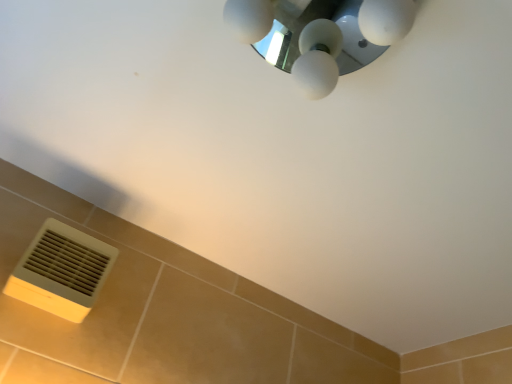
Question: Is white glossy light fixture at upper center oriented towards beige plastic air conditioning at lower left?

Choices:
 (A) yes
 (B) no

Answer: (B)

Question: Can you confirm if white glossy light fixture at upper center is shorter than beige plastic air conditioning at lower left?

Choices:
 (A) yes
 (B) no

Answer: (A)

Question: From the image's perspective, is white glossy light fixture at upper center on beige plastic air conditioning at lower left?

Choices:
 (A) no
 (B) yes

Answer: (B)

Question: From a real-world perspective, is white glossy light fixture at upper center located higher than beige plastic air conditioning at lower left?

Choices:
 (A) yes
 (B) no

Answer: (A)

Question: From the image's perspective, does white glossy light fixture at upper center appear lower than beige plastic air conditioning at lower left?

Choices:
 (A) no
 (B) yes

Answer: (A)

Question: Does white glossy light fixture at upper center have a greater width compared to beige plastic air conditioning at lower left?

Choices:
 (A) yes
 (B) no

Answer: (A)

Question: Is beige plastic air conditioning at lower left wider than white glossy light fixture at upper center?

Choices:
 (A) no
 (B) yes

Answer: (A)

Question: Considering the relative sizes of beige plastic air conditioning at lower left and white glossy light fixture at upper center in the image provided, is beige plastic air conditioning at lower left shorter than white glossy light fixture at upper center?

Choices:
 (A) no
 (B) yes

Answer: (A)

Question: Is the position of beige plastic air conditioning at lower left more distant than that of white glossy light fixture at upper center?

Choices:
 (A) yes
 (B) no

Answer: (A)

Question: Can you confirm if beige plastic air conditioning at lower left is thinner than white glossy light fixture at upper center?

Choices:
 (A) yes
 (B) no

Answer: (A)

Question: From the image's perspective, would you say beige plastic air conditioning at lower left is shown under white glossy light fixture at upper center?

Choices:
 (A) no
 (B) yes

Answer: (B)

Question: Can you see beige plastic air conditioning at lower left touching white glossy light fixture at upper center?

Choices:
 (A) no
 (B) yes

Answer: (A)

Question: From the image's perspective, relative to beige plastic air conditioning at lower left, is white glossy light fixture at upper center above or below?

Choices:
 (A) above
 (B) below

Answer: (A)